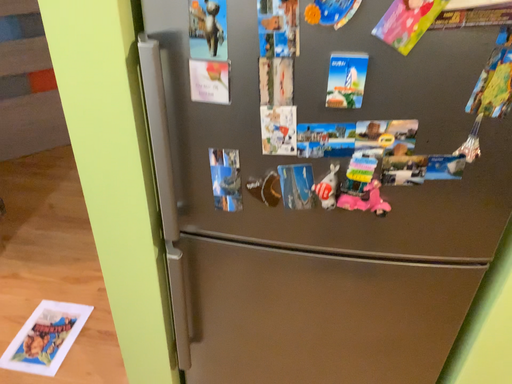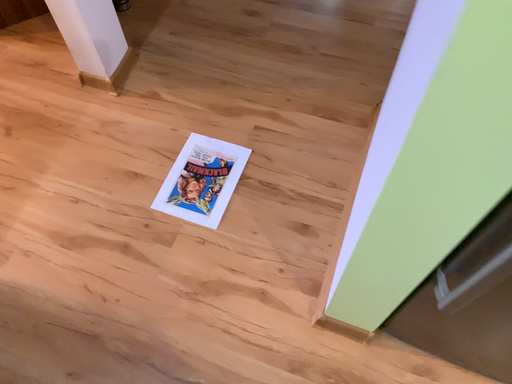
Question: How did the camera likely rotate when shooting the video?

Choices:
 (A) rotated right
 (B) rotated left

Answer: (B)